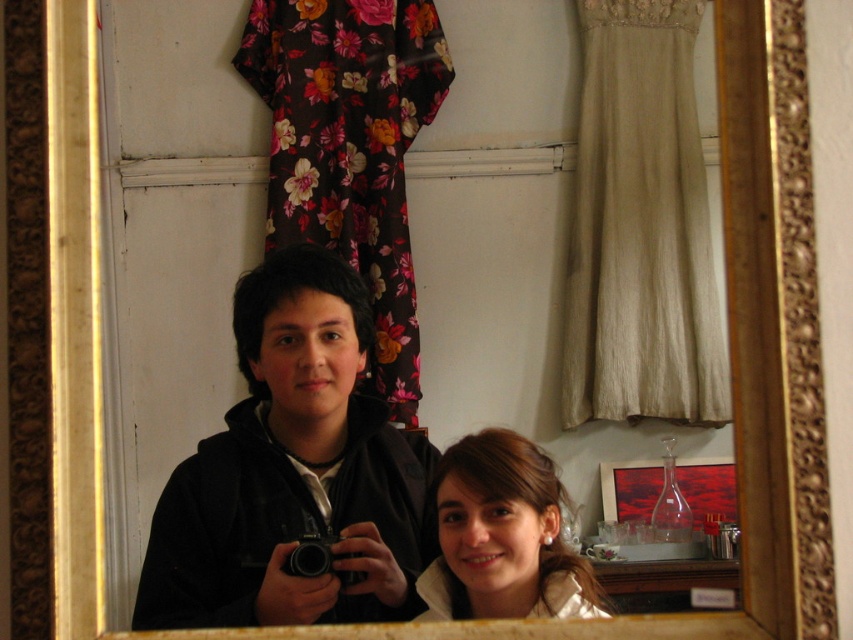
Question: Is black matte jacket at center below black plastic camera at center?

Choices:
 (A) yes
 (B) no

Answer: (B)

Question: Estimate the real-world distances between objects in this image. Which object is farther from the black matte jacket at center?

Choices:
 (A) smooth brown hair at lower right
 (B) black plastic camera at center

Answer: (B)

Question: Is black matte jacket at center above smooth brown hair at lower right?

Choices:
 (A) no
 (B) yes

Answer: (B)

Question: Among these points, which one is nearest to the camera?

Choices:
 (A) (322, 556)
 (B) (582, 584)

Answer: (A)

Question: Which object is the closest to the black plastic camera at center?

Choices:
 (A) black matte jacket at center
 (B) smooth brown hair at lower right

Answer: (B)

Question: Does smooth brown hair at lower right appear under black plastic camera at center?

Choices:
 (A) yes
 (B) no

Answer: (B)